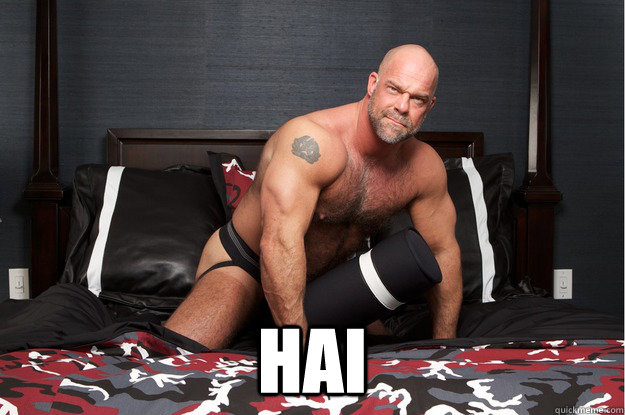
Identify the location of pillow. The image size is (625, 415). (182, 229), (479, 233).